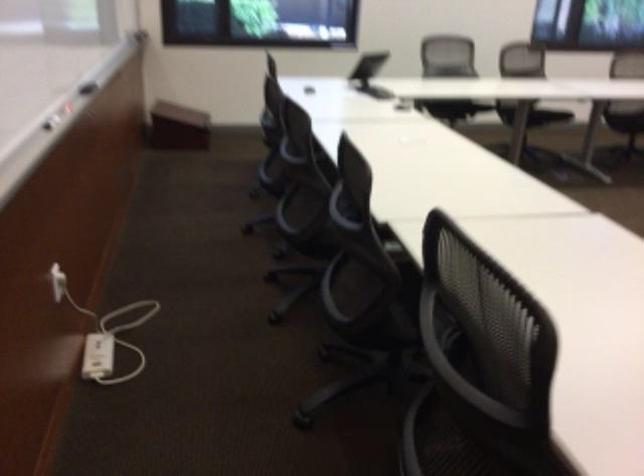
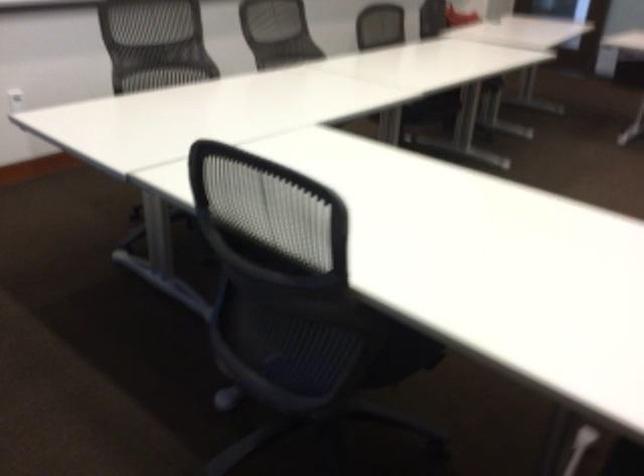
The images are taken continuously from a first-person perspective. In which direction is your viewpoint rotating?

The rotation direction of the camera is right-down.